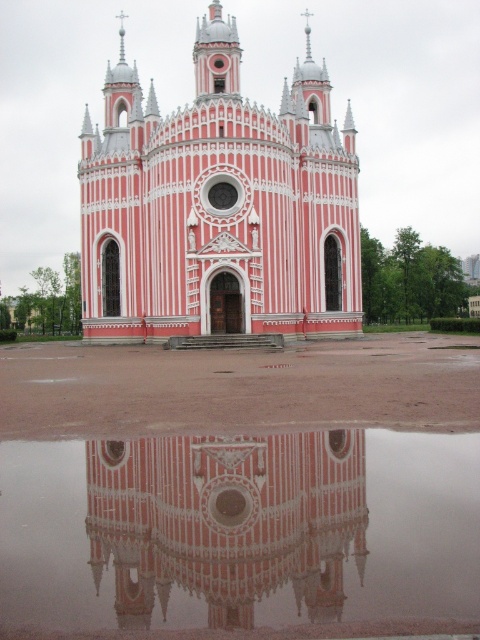
You are an architect planning to build a new structure adjacent to the pink polished stone church at center and the pink glossy building at center. Given their widths, which one should you place closer to the entrance to ensure proper spacing?

The pink polished stone church at center is wider than the pink glossy building at center, so you should place the pink glossy building at center closer to the entrance to allow sufficient space for the wider church.

You are standing at the entrance of a park and see the pink polished stone church at center. If you walk straight ahead, will you move closer to the church?

Yes, walking straight ahead from the entrance of the park will move you closer to the pink polished stone church at center since it is located at the center of the image.